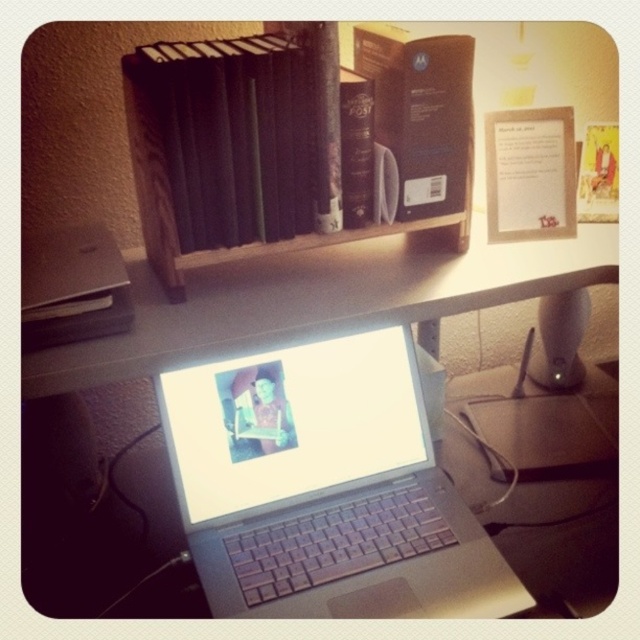
Is point (164, 268) positioned behind point (476, 243)?

No, (164, 268) is in front of (476, 243).

This screenshot has width=640, height=640. In order to click on wooden bookshelf at upper center in this screenshot , I will do `click(294, 141)`.

Which is in front, point (252, 378) or point (131, 348)?

Point (131, 348) is in front.

Does point (205, 444) come in front of point (170, 342)?

No.

Where is `satin silver laptop at center`? satin silver laptop at center is located at coordinates (324, 488).

Is satin silver laptop at center shorter than wooden bookshelf at upper center?

Yes.

Is satin silver laptop at center thinner than wooden bookshelf at upper center?

Yes.

Locate an element on the screen. Image resolution: width=640 pixels, height=640 pixels. satin silver laptop at center is located at coordinates pyautogui.click(x=324, y=488).

Identify the location of satin silver laptop at center. The height and width of the screenshot is (640, 640). (324, 488).